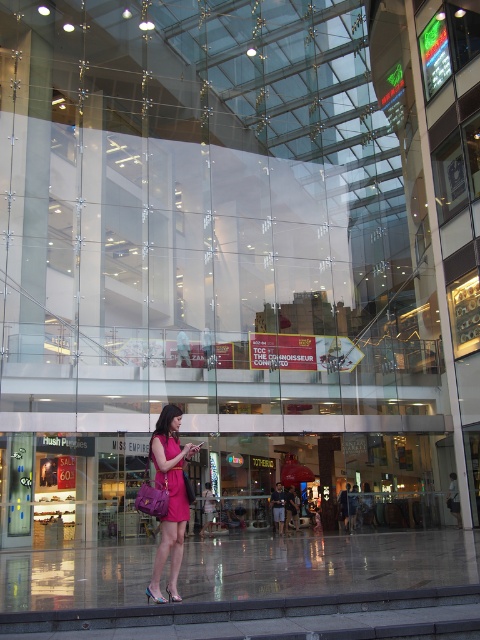
Question: Where is pink fabric dress at center located in relation to matte pink dress at center in the image?

Choices:
 (A) above
 (B) below

Answer: (B)

Question: Can you confirm if pink fabric dress at center is bigger than matte pink dress at center?

Choices:
 (A) yes
 (B) no

Answer: (A)

Question: Is pink fabric dress at center smaller than matte pink dress at center?

Choices:
 (A) no
 (B) yes

Answer: (A)

Question: Among these objects, which one is nearest to the camera?

Choices:
 (A) matte pink dress at center
 (B) pink fabric dress at center

Answer: (B)